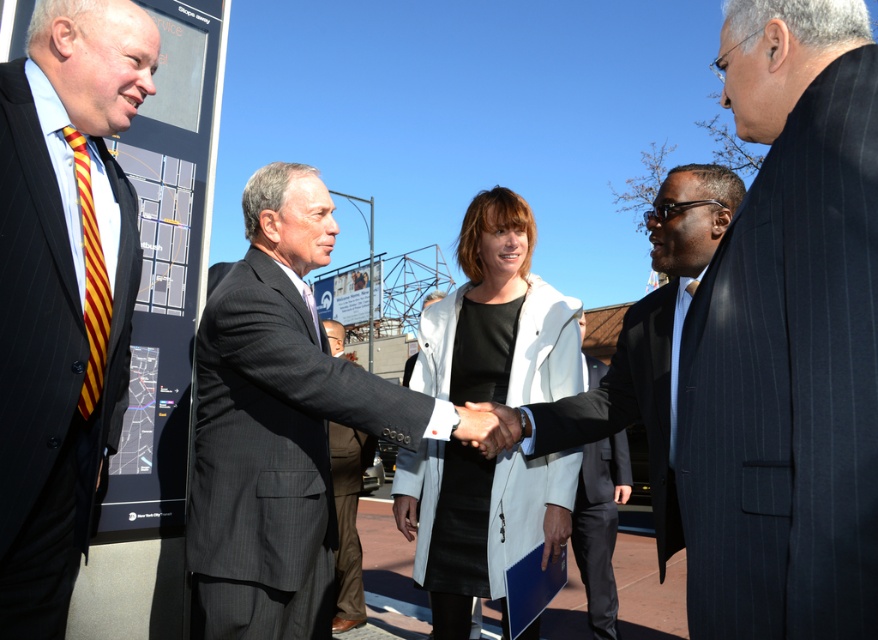
Is striped tie at left positioned in front of white matte coat at center?

That is True.

Which of these two, striped tie at left or white matte coat at center, stands shorter?

With less height is striped tie at left.

Which is in front, point (87, 515) or point (563, 358)?

Positioned in front is point (87, 515).

You are a GUI agent. You are given a task and a screenshot of the screen. Output one action in this format:
    pyautogui.click(x=<x>, y=<y>)
    Task: Click on the striped tie at left
    The width and height of the screenshot is (878, 640).
    Given the screenshot: What is the action you would take?
    click(x=63, y=291)

Does dark gray suit at center have a greater width compared to white matte coat at center?

Indeed, dark gray suit at center has a greater width compared to white matte coat at center.

Looking at this image, can you confirm if dark gray suit at center is positioned above white matte coat at center?

Indeed, dark gray suit at center is positioned over white matte coat at center.

Who is more forward, [284,576] or [579,372]?

Point [284,576] is in front.

Find the location of a particular element. Image resolution: width=878 pixels, height=640 pixels. dark gray suit at center is located at coordinates (278, 422).

Between point (30, 76) and point (602, 465), which one is positioned in front?

Point (30, 76) is in front.

Is point (83, 125) more distant than point (589, 465)?

No, (83, 125) is closer to viewer.

This screenshot has height=640, width=878. I want to click on striped tie at left, so click(63, 291).